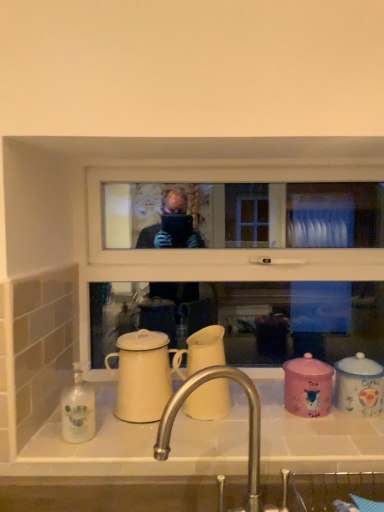
What are the coordinates of `free space in front of white matte coffee cup at center, the third coffee cup when ordered from right to left` in the screenshot? It's located at (211, 446).